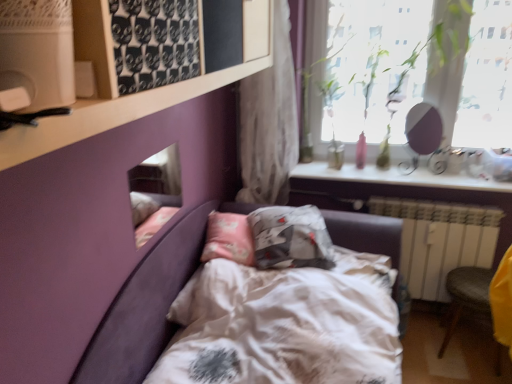
Question: Should I look upward or downward to see yellow fabric armchair at lower right?

Choices:
 (A) down
 (B) up

Answer: (A)

Question: Is white matte shelf at upper left to the right of white painted metal radiator at lower right from the viewer's perspective?

Choices:
 (A) yes
 (B) no

Answer: (B)

Question: Is white matte shelf at upper left at the left side of white painted metal radiator at lower right?

Choices:
 (A) yes
 (B) no

Answer: (A)

Question: Is white matte shelf at upper left not within white painted metal radiator at lower right?

Choices:
 (A) no
 (B) yes

Answer: (B)

Question: From the image's perspective, is white matte shelf at upper left over white painted metal radiator at lower right?

Choices:
 (A) no
 (B) yes

Answer: (B)

Question: Is white matte shelf at upper left aimed at white painted metal radiator at lower right?

Choices:
 (A) no
 (B) yes

Answer: (A)

Question: Is white matte shelf at upper left smaller than white painted metal radiator at lower right?

Choices:
 (A) yes
 (B) no

Answer: (B)

Question: Would you say white matte shelf at upper left is part of yellow fabric armchair at lower right's contents?

Choices:
 (A) no
 (B) yes

Answer: (A)

Question: Is yellow fabric armchair at lower right thinner than white matte shelf at upper left?

Choices:
 (A) no
 (B) yes

Answer: (B)

Question: From a real-world perspective, does yellow fabric armchair at lower right stand above white matte shelf at upper left?

Choices:
 (A) no
 (B) yes

Answer: (A)

Question: Considering the relative positions of yellow fabric armchair at lower right and white matte shelf at upper left in the image provided, is yellow fabric armchair at lower right behind white matte shelf at upper left?

Choices:
 (A) no
 (B) yes

Answer: (B)

Question: Considering the relative sizes of yellow fabric armchair at lower right and white matte shelf at upper left in the image provided, is yellow fabric armchair at lower right smaller than white matte shelf at upper left?

Choices:
 (A) no
 (B) yes

Answer: (B)

Question: Is yellow fabric armchair at lower right far away from white matte shelf at upper left?

Choices:
 (A) no
 (B) yes

Answer: (B)

Question: Is yellow fabric armchair at lower right at the back of white textured curtain at upper center?

Choices:
 (A) no
 (B) yes

Answer: (A)